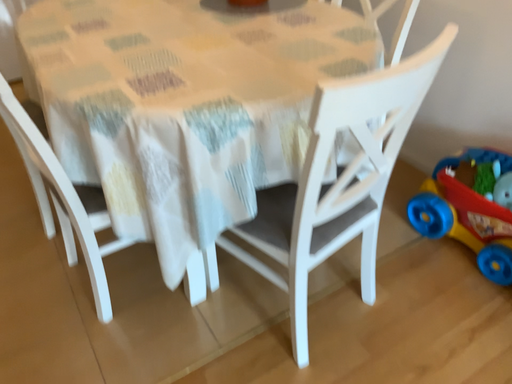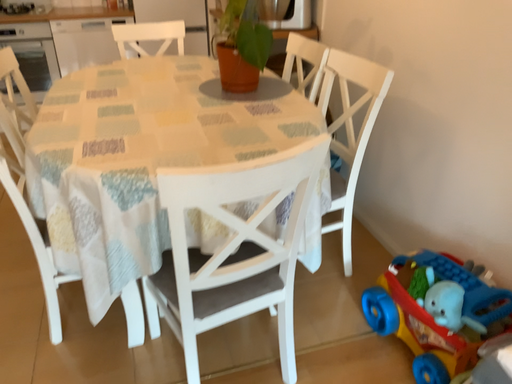
Question: Which way did the camera rotate in the video?

Choices:
 (A) rotated downward
 (B) rotated upward

Answer: (B)